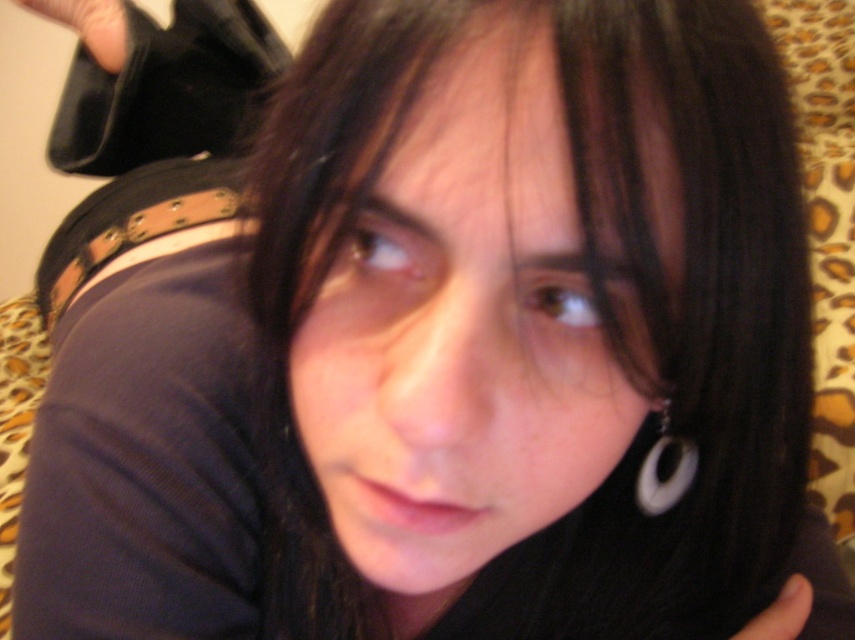
You are a photographer adjusting the lighting in a studio. You notice the smooth skin face at center and the black matte finger at lower right in the frame. Which object should you adjust the light to highlight first if you want to ensure the face is properly lit?

The smooth skin face at center should be highlighted first because it is in front of the black matte finger at lower right, making it the primary subject in the frame.

You are holding a white plastic hoop at lower right and want to place it closer to the camera. Currently, it is 11.12 inches away. If you move it 5 inches forward, will it be within the camera frame? Please explain.

Moving the white plastic hoop at lower right 5 inches forward would bring it to 6.12 inches from the camera. Since the camera frame typically accommodates objects within this proximity, the hoop would be within the frame.